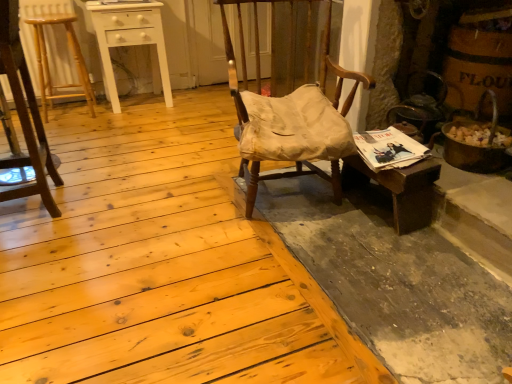
What are the coordinates of `vacant area in front of wooden desk at right` in the screenshot? It's located at (392, 251).